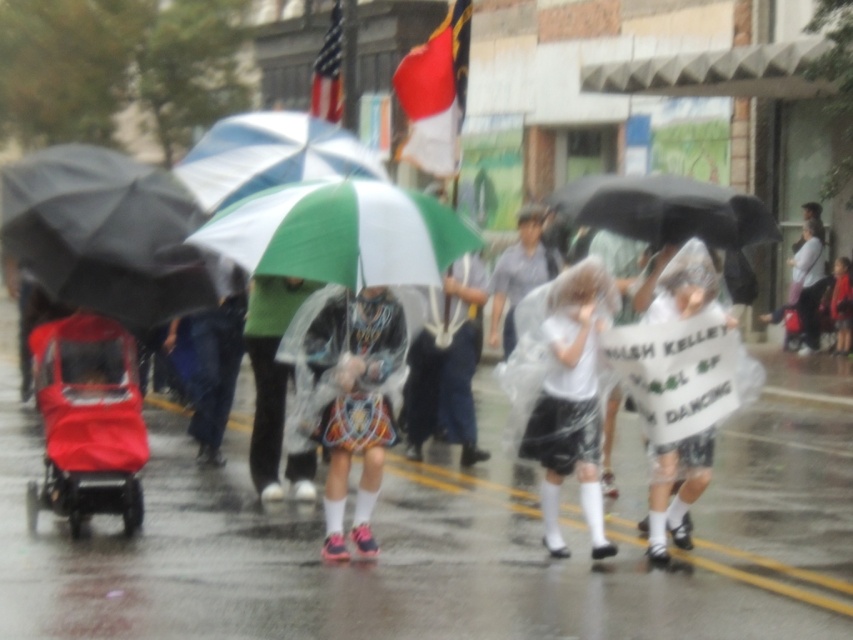
Question: Which object is closer to the camera taking this photo?

Choices:
 (A) black matte umbrella at upper center
 (B) red fabric flag at upper center
 (C) red fabric stroller at left

Answer: (C)

Question: Is matte colorful skirt at center thinner than red fabric flag at upper center?

Choices:
 (A) no
 (B) yes

Answer: (B)

Question: Does matte colorful skirt at center have a smaller size compared to black matte umbrella at upper center?

Choices:
 (A) yes
 (B) no

Answer: (B)

Question: Does red fabric flag at upper center have a greater width compared to american flag at upper center?

Choices:
 (A) no
 (B) yes

Answer: (A)

Question: Which object is the farthest from the white cotton shirt at center?

Choices:
 (A) black matte umbrella at left
 (B) black matte umbrella at upper center
 (C) white matte shirt at center
 (D) wet asphalt at lower center

Answer: (D)

Question: Which point appears farthest from the camera in this image?

Choices:
 (A) (262, 172)
 (B) (412, 92)

Answer: (B)